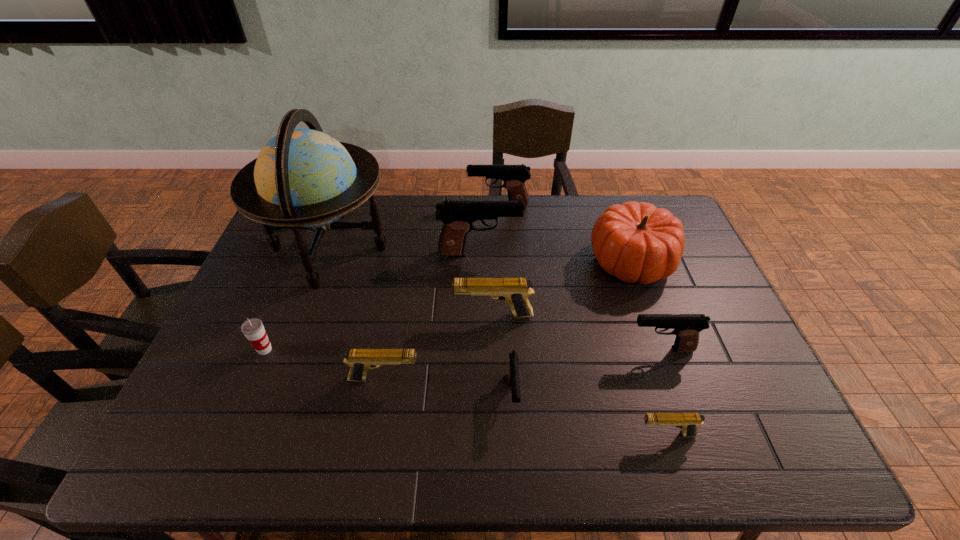
You are a GUI agent. You are given a task and a screenshot of the screen. Output one action in this format:
    pyautogui.click(x=<x>, y=<y>)
    Task: Click on the globe
    This screenshot has width=960, height=540.
    Given the screenshot: What is the action you would take?
    pyautogui.click(x=303, y=178)

Locate an element on the screen. This screenshot has height=540, width=960. the third nearest black pistol is located at coordinates (457, 216).

Image resolution: width=960 pixels, height=540 pixels. What are the coordinates of `the tallest pistol` in the screenshot? It's located at (457, 216).

Locate an element on the screen. This screenshot has height=540, width=960. pumpkin is located at coordinates (636, 242).

At what (x,y) coordinates should I click in order to perform the action: click on the farthest pistol. Please return your answer as a coordinate pair (x, y). Image resolution: width=960 pixels, height=540 pixels. Looking at the image, I should click on (514, 176).

This screenshot has width=960, height=540. Identify the location of the sixth shortest pistol. (514, 176).

Where is `the second tan pistol from right to left`? the second tan pistol from right to left is located at coordinates (515, 291).

Locate an element on the screen. the biggest tan pistol is located at coordinates (515, 291).

This screenshot has height=540, width=960. Identify the location of the fourth nearest pistol. 687,327.

At what (x,y) coordinates should I click in order to perform the action: click on the second smallest black pistol. Please return your answer as a coordinate pair (x, y). This screenshot has width=960, height=540. Looking at the image, I should click on (687, 327).